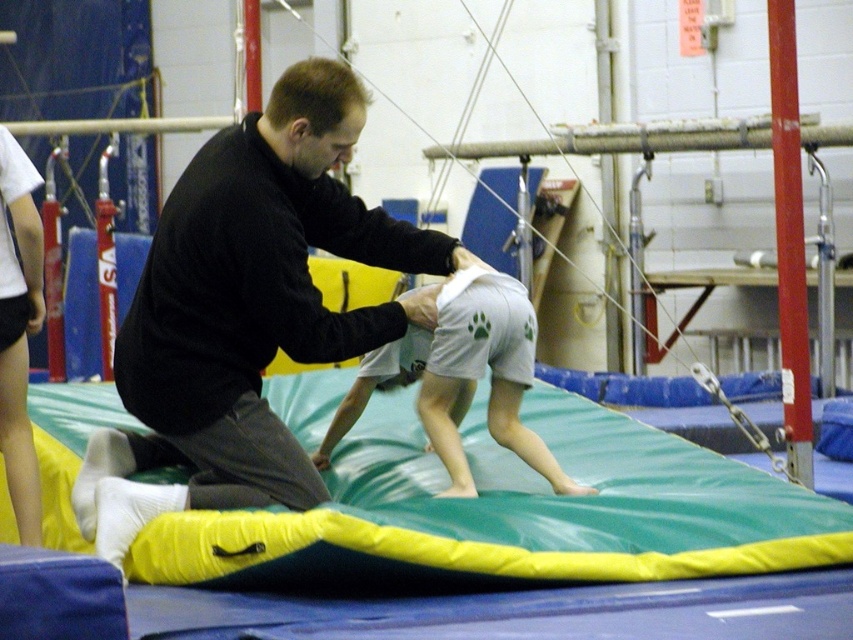
Question: Estimate the real-world distances between objects in this image. Which object is closer to the white cotton shorts at center?

Choices:
 (A) green foam mat at center
 (B) black matte shirt at center

Answer: (B)

Question: Is green foam mat at center below black matte shirt at center?

Choices:
 (A) no
 (B) yes

Answer: (B)

Question: Considering the real-world distances, which object is farthest from the black matte shirt at center?

Choices:
 (A) green foam mat at center
 (B) white cotton shorts at center

Answer: (A)

Question: Is black matte shirt at center bigger than white cotton shorts at center?

Choices:
 (A) no
 (B) yes

Answer: (B)

Question: Which point appears closest to the camera in this image?

Choices:
 (A) (480, 291)
 (B) (53, 396)
 (C) (131, 497)

Answer: (C)

Question: Does green foam mat at center have a larger size compared to black matte shirt at center?

Choices:
 (A) yes
 (B) no

Answer: (B)